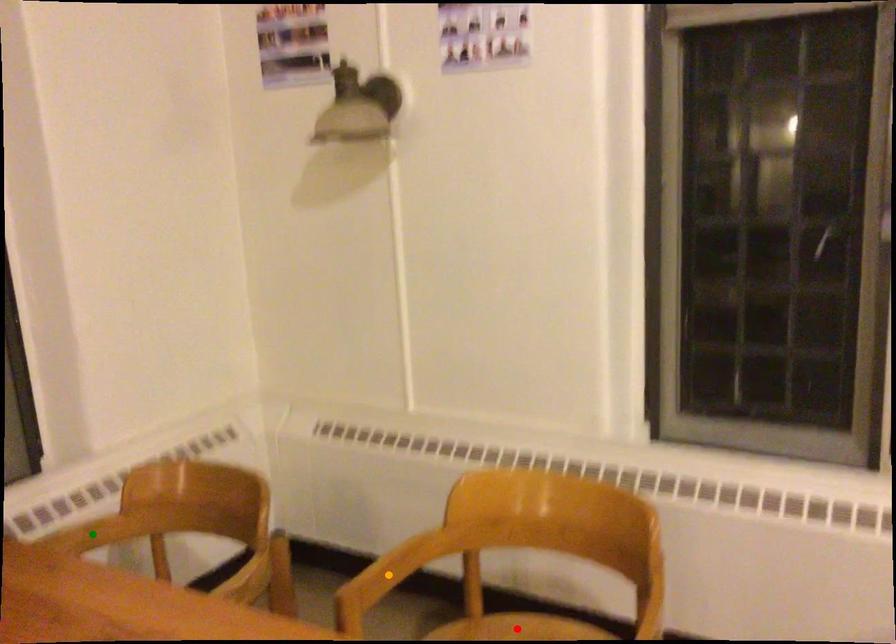
Order these from nearest to farthest:
1. orange point
2. green point
3. red point

orange point, red point, green point